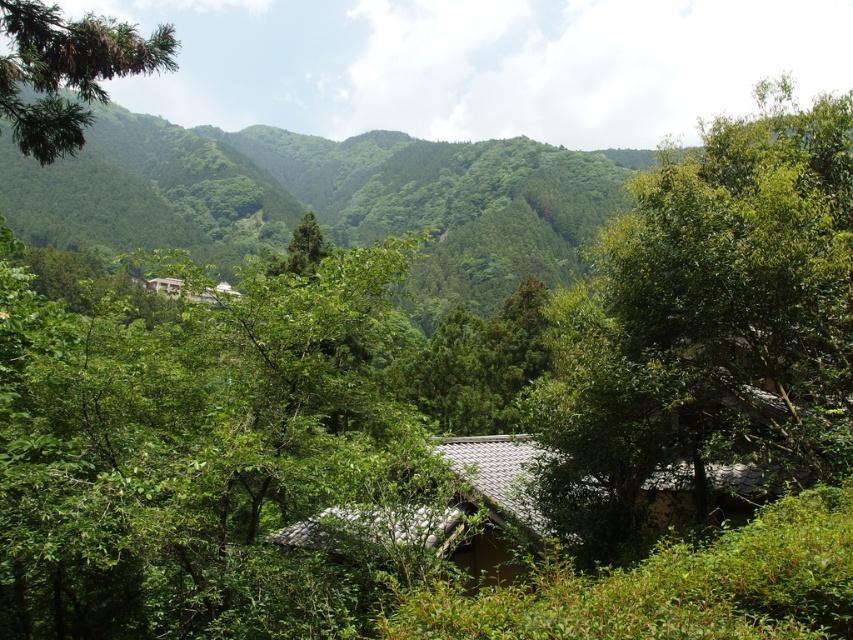
I want to click on brown tile roof hut at center, so click(448, 509).

What do you see at coordinates (448, 509) in the screenshot? The image size is (853, 640). I see `brown tile roof hut at center` at bounding box center [448, 509].

What do you see at coordinates (448, 509) in the screenshot? The width and height of the screenshot is (853, 640). I see `brown tile roof hut at center` at bounding box center [448, 509].

You are a GUI agent. You are given a task and a screenshot of the screen. Output one action in this format:
    pyautogui.click(x=<x>, y=<y>)
    Task: Click on the brown tile roof hut at center
    The width and height of the screenshot is (853, 640).
    Given the screenshot: What is the action you would take?
    pyautogui.click(x=448, y=509)

Based on the photo, does green leafy tree at center have a greater height compared to brown tile roof hut at center?

Yes, green leafy tree at center is taller than brown tile roof hut at center.

Who is more forward, (x=711, y=460) or (x=469, y=536)?

Positioned in front is point (x=711, y=460).

Where is `green leafy tree at center`? The width and height of the screenshot is (853, 640). green leafy tree at center is located at coordinates (706, 323).

At what (x,y) coordinates should I click in order to perform the action: click on green leafy tree at center. Please return your answer as a coordinate pair (x, y). Image resolution: width=853 pixels, height=640 pixels. Looking at the image, I should click on [706, 323].

Who is positioned more to the right, brown tile roof hut at center or light brown wooden hut at center?

Positioned to the right is brown tile roof hut at center.

Is brown tile roof hut at center in front of light brown wooden hut at center?

Yes, brown tile roof hut at center is closer to the viewer.

Locate an element on the screen. The height and width of the screenshot is (640, 853). brown tile roof hut at center is located at coordinates (448, 509).